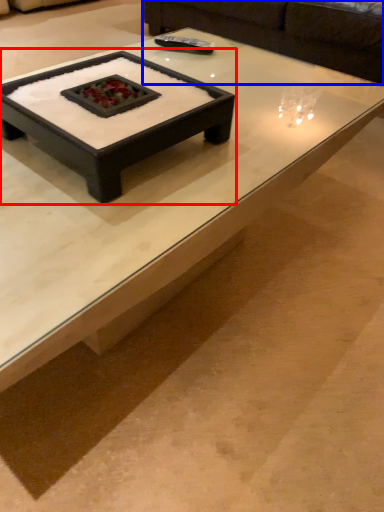
Question: Which object is further to the camera taking this photo, coffee table (highlighted by a red box) or couch (highlighted by a blue box)?

Choices:
 (A) coffee table
 (B) couch

Answer: (B)